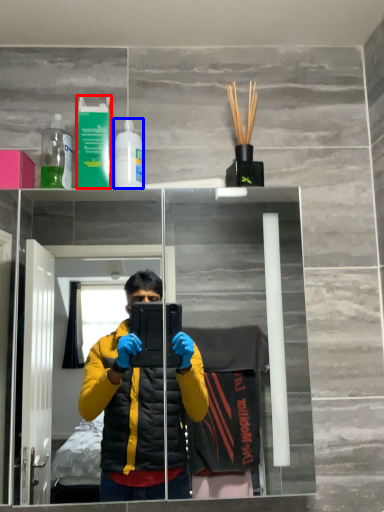
Question: Which of the following is the closest to the observer, mouthwash (highlighted by a red box) or bottle (highlighted by a blue box)?

Choices:
 (A) mouthwash
 (B) bottle

Answer: (A)